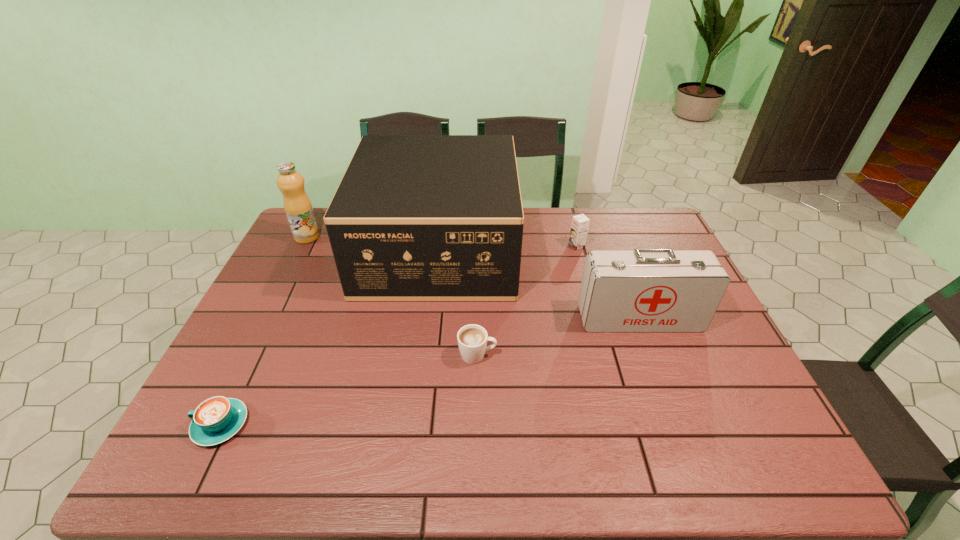
The height and width of the screenshot is (540, 960). What are the coordinates of `object located at the right edge` in the screenshot? It's located at (643, 290).

The height and width of the screenshot is (540, 960). I want to click on object that is at the far left corner, so click(298, 208).

The height and width of the screenshot is (540, 960). In order to click on object that is at the near left corner in this screenshot , I will do `click(215, 420)`.

In the image, there is a desktop. Where is `vacant space at the far edge`? vacant space at the far edge is located at coordinates (566, 245).

The image size is (960, 540). In the image, there is a desktop. Find the location of `vacant space at the left edge`. vacant space at the left edge is located at coordinates (291, 300).

Image resolution: width=960 pixels, height=540 pixels. In the image, there is a desktop. What are the coordinates of `free space at the right edge` in the screenshot? It's located at coord(730,361).

Locate an element on the screen. free region at the near right corner of the desktop is located at coordinates (725, 461).

Identify the location of free space between the left cappuccino and the fourth tallest object. The height and width of the screenshot is (540, 960). (398, 335).

At what (x,y) coordinates should I click in order to perform the action: click on free spot between the shortest object and the chocolate milk. Please return your answer as a coordinate pair (x, y). Looking at the image, I should click on (398, 335).

Identify the location of free space between the taller cappuccino and the fourth tallest object. (527, 301).